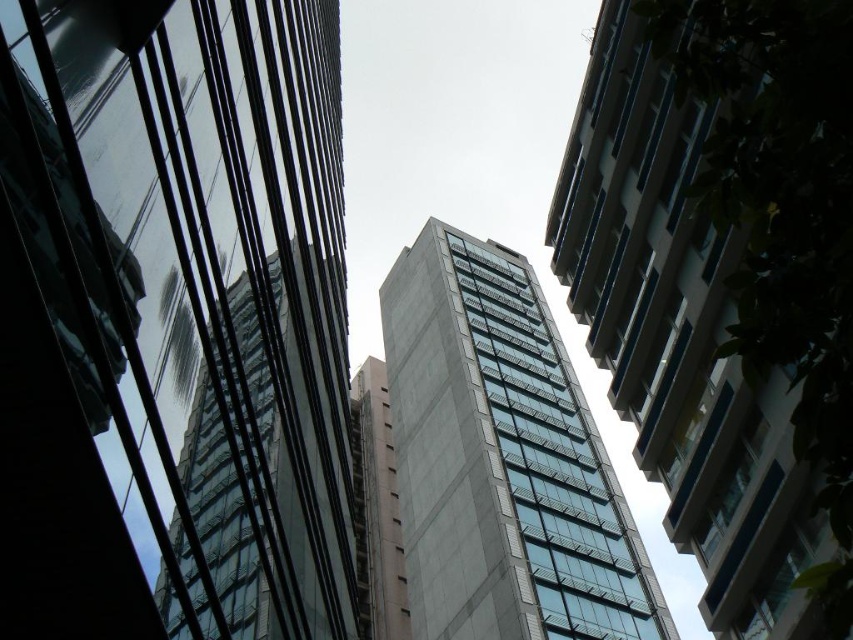
Question: Which object is farther from the camera taking this photo?

Choices:
 (A) gray concrete building at center
 (B) transparent glass building at center

Answer: (A)

Question: Can you confirm if glassy blue building at center is thinner than pink concrete building at center?

Choices:
 (A) no
 (B) yes

Answer: (B)

Question: Can you confirm if glassy blue building at center is positioned to the right of transparent glass building at center?

Choices:
 (A) no
 (B) yes

Answer: (B)

Question: Which point is farther to the camera?

Choices:
 (A) transparent glass building at center
 (B) glassy blue building at center

Answer: (A)

Question: Is gray concrete building at center to the left of pink concrete building at center from the viewer's perspective?

Choices:
 (A) yes
 (B) no

Answer: (B)

Question: Which of the following is the closest to the observer?

Choices:
 (A) gray concrete building at center
 (B) transparent glass building at center

Answer: (B)